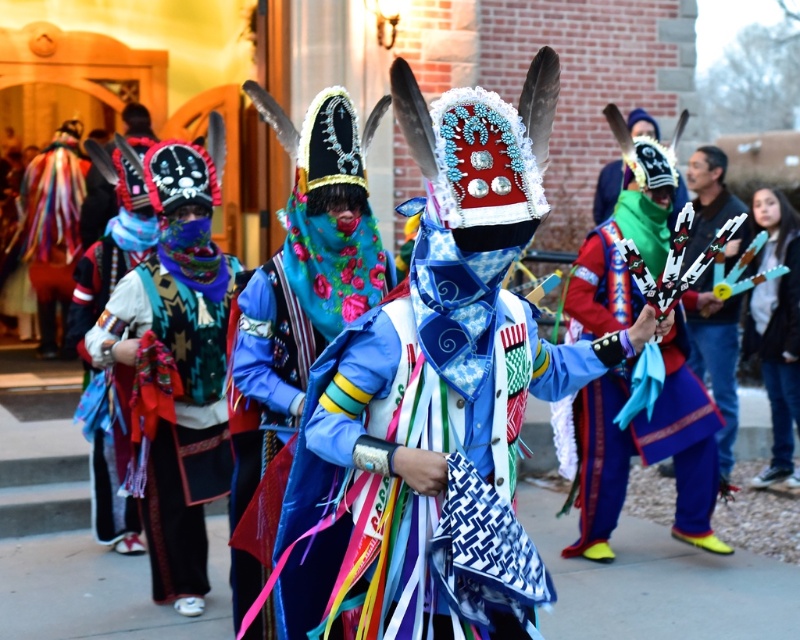
You are an anthropologist observing a cultural ceremony. You notice the blue satin headdress at center and the blue denim jeans at right. Which object is shorter in height?

The blue satin headdress at center is shorter in height than the blue denim jeans at right.

You are an attendee at the ceremony and want to describe the central figures to a friend. Which object is positioned to the left of the other between the matte black mask at center and the blue satin headdress at center?

The matte black mask at center is positioned to the left of the blue satin headdress at center.

You are standing in the middle of the crowd at this cultural event. You notice two points marked in the scene. One is at coordinate point (348, 218) and the other at point (713, 179). Which of these points is closer to you?

Point (348, 218) is closer to the camera than point (713, 179), so the point at coordinate (348, 218) is closer to you.